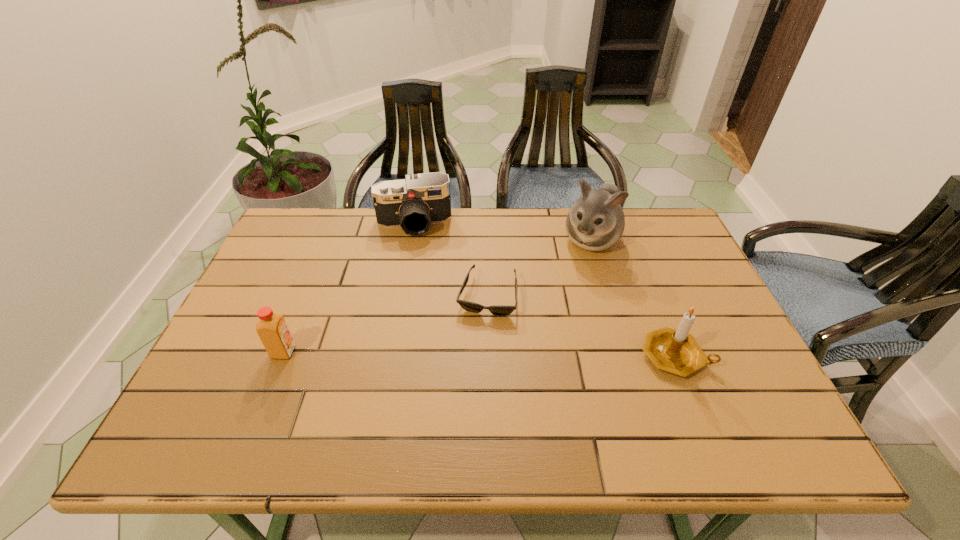
Image resolution: width=960 pixels, height=540 pixels. In order to click on free space that satisfies the following two spatial constraints: 1. on the front side of the camera; 2. on the right side of the shortest object in this screenshot , I will do pos(400,295).

I want to click on free spot that satisfies the following two spatial constraints: 1. on the front side of the camera; 2. on the right side of the tallest object, so click(411, 240).